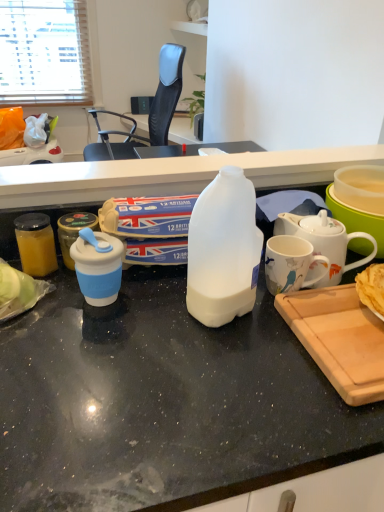
Question: Would you say translucent plastic milk bottle at center is part of wooden cutting board at lower right's contents?

Choices:
 (A) no
 (B) yes

Answer: (A)

Question: Can you confirm if wooden cutting board at lower right is wider than translucent plastic milk bottle at center?

Choices:
 (A) yes
 (B) no

Answer: (B)

Question: Is wooden cutting board at lower right completely or partially outside of translucent plastic milk bottle at center?

Choices:
 (A) no
 (B) yes

Answer: (A)

Question: Is wooden cutting board at lower right in front of translucent plastic milk bottle at center?

Choices:
 (A) yes
 (B) no

Answer: (B)

Question: Is wooden cutting board at lower right at the left side of translucent plastic milk bottle at center?

Choices:
 (A) yes
 (B) no

Answer: (B)

Question: From the image's perspective, is blue matte coffee cup at left, which ranks as the 1th coffee cup in left-to-right order, positioned above or below translucent glass jar at left, the second kitchen appliance in the right-to-left sequence?

Choices:
 (A) below
 (B) above

Answer: (A)

Question: Based on their positions, is blue matte coffee cup at left, the 2th coffee cup from the right, located to the left or right of translucent glass jar at left, the first kitchen appliance from the left?

Choices:
 (A) left
 (B) right

Answer: (B)

Question: Is blue matte coffee cup at left, which ranks as the 1th coffee cup in left-to-right order, bigger or smaller than translucent glass jar at left, the first kitchen appliance from the left?

Choices:
 (A) big
 (B) small

Answer: (A)

Question: Is blue matte coffee cup at left, the 2th coffee cup from the right, in front of or behind translucent glass jar at left, the first kitchen appliance from the left, in the image?

Choices:
 (A) behind
 (B) front

Answer: (B)

Question: From a real-world perspective, is white matte plastic bottle at center positioned above or below translucent plastic bowl at right?

Choices:
 (A) above
 (B) below

Answer: (A)

Question: Is white matte plastic bottle at center wider or thinner than translucent plastic bowl at right?

Choices:
 (A) thin
 (B) wide

Answer: (A)

Question: Is white matte plastic bottle at center in front of or behind translucent plastic bowl at right in the image?

Choices:
 (A) front
 (B) behind

Answer: (A)

Question: Is white matte plastic bottle at center spatially inside translucent plastic bowl at right, or outside of it?

Choices:
 (A) outside
 (B) inside

Answer: (A)

Question: Is black mesh chair at upper center to the left or to the right of translucent glass jar at left, the second kitchen appliance in the right-to-left sequence, in the image?

Choices:
 (A) right
 (B) left

Answer: (B)

Question: From the image's perspective, is black mesh chair at upper center located above or below translucent glass jar at left, the second kitchen appliance in the right-to-left sequence?

Choices:
 (A) below
 (B) above

Answer: (B)